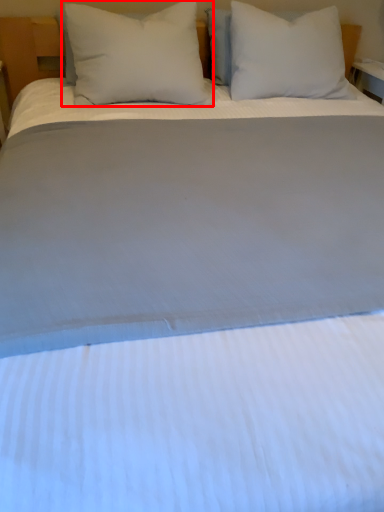
Question: In this image, where is pillow (annotated by the red box) located relative to pillow?

Choices:
 (A) left
 (B) right

Answer: (A)